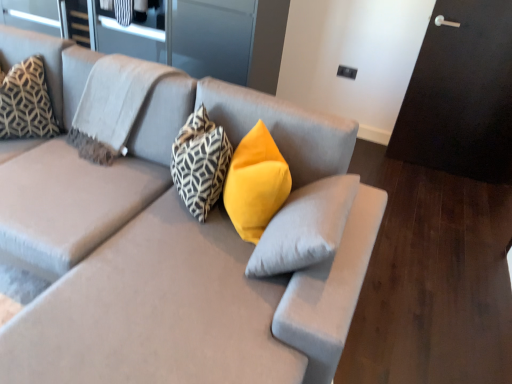
Question: Can you see matte gray couch at center touching geometric-patterned fabric pillow at upper left, the 4th pillow viewed from the right?

Choices:
 (A) no
 (B) yes

Answer: (A)

Question: Is geometric-patterned fabric pillow at upper left, which is the 1th pillow from left to right, completely or partially inside matte gray couch at center?

Choices:
 (A) no
 (B) yes

Answer: (A)

Question: Can you confirm if matte gray couch at center is positioned to the right of geometric-patterned fabric pillow at upper left, the 4th pillow viewed from the right?

Choices:
 (A) no
 (B) yes

Answer: (B)

Question: From a real-world perspective, is matte gray couch at center positioned over geometric-patterned fabric pillow at upper left, the 4th pillow viewed from the right, based on gravity?

Choices:
 (A) no
 (B) yes

Answer: (A)

Question: Is matte gray couch at center completely or partially outside of geometric-patterned fabric pillow at upper left, which is the 1th pillow from left to right?

Choices:
 (A) no
 (B) yes

Answer: (B)

Question: Looking at the image, does yellow velvet pillow at center, placed as the 1th pillow when sorted from right to left, seem bigger or smaller compared to geometric-patterned fabric pillow at upper left, which is the 1th pillow from left to right?

Choices:
 (A) small
 (B) big

Answer: (A)

Question: In terms of width, does yellow velvet pillow at center, arranged as the 4th pillow when viewed from the left, look wider or thinner when compared to geometric-patterned fabric pillow at upper left, the 4th pillow viewed from the right?

Choices:
 (A) wide
 (B) thin

Answer: (B)

Question: Considering the relative positions of yellow velvet pillow at center, arranged as the 4th pillow when viewed from the left, and geometric-patterned fabric pillow at upper left, the 4th pillow viewed from the right, in the image provided, is yellow velvet pillow at center, arranged as the 4th pillow when viewed from the left, to the left or to the right of geometric-patterned fabric pillow at upper left, the 4th pillow viewed from the right,?

Choices:
 (A) right
 (B) left

Answer: (A)

Question: Relative to geometric-patterned fabric pillow at upper left, which is the 1th pillow from left to right, is yellow velvet pillow at center, placed as the 1th pillow when sorted from right to left, in front or behind?

Choices:
 (A) front
 (B) behind

Answer: (A)

Question: Is geometric-patterned fabric pillow at upper left, which is the 1th pillow from left to right, situated inside geometric-patterned fabric pillow at center, which is the second pillow in right-to-left order, or outside?

Choices:
 (A) inside
 (B) outside

Answer: (B)

Question: Is geometric-patterned fabric pillow at upper left, which is the 1th pillow from left to right, bigger or smaller than geometric-patterned fabric pillow at center, which is the second pillow in right-to-left order?

Choices:
 (A) big
 (B) small

Answer: (A)

Question: From the image's perspective, relative to geometric-patterned fabric pillow at center, which is the second pillow in right-to-left order, is geometric-patterned fabric pillow at upper left, the 4th pillow viewed from the right, above or below?

Choices:
 (A) above
 (B) below

Answer: (A)

Question: Is geometric-patterned fabric pillow at upper left, which is the 1th pillow from left to right, to the left or to the right of geometric-patterned fabric pillow at center, acting as the 3th pillow starting from the left, in the image?

Choices:
 (A) left
 (B) right

Answer: (A)

Question: From the image's perspective, is patterned fabric pillow at upper left, which appears as the second pillow when viewed from the left, located above or below matte gray couch at center?

Choices:
 (A) above
 (B) below

Answer: (A)

Question: From a real-world perspective, relative to matte gray couch at center, is patterned fabric pillow at upper left, which appears as the second pillow when viewed from the left, vertically above or below?

Choices:
 (A) above
 (B) below

Answer: (A)